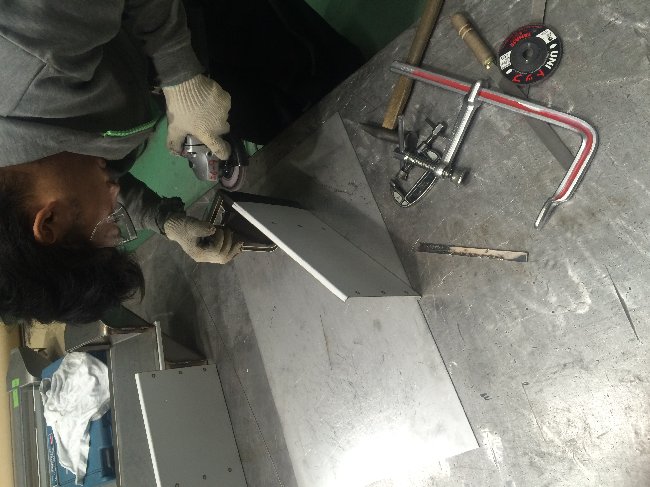
The image size is (650, 487). Find the location of `floor`. floor is located at coordinates (385, 33).